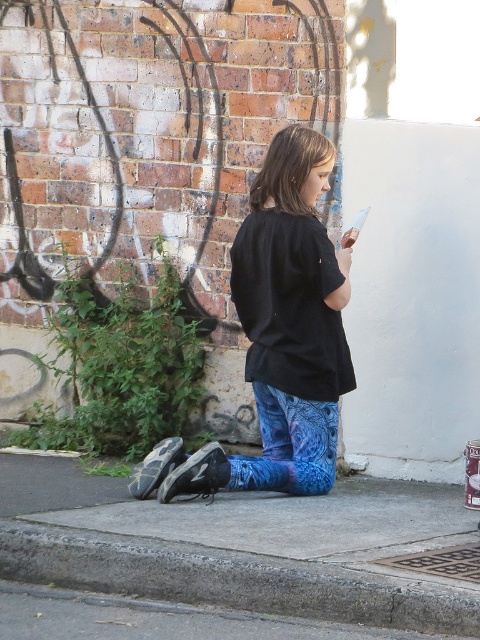
You are a photographer trying to capture the black cotton shirt at center and the gray concrete curb at lower left in the same frame. Which object should you focus on first if you want to ensure both are in focus?

The black cotton shirt at center is taller than the gray concrete curb at lower left. To ensure both are in focus, focus on the black cotton shirt at center first, as it is larger in the frame and requires more precise focus.